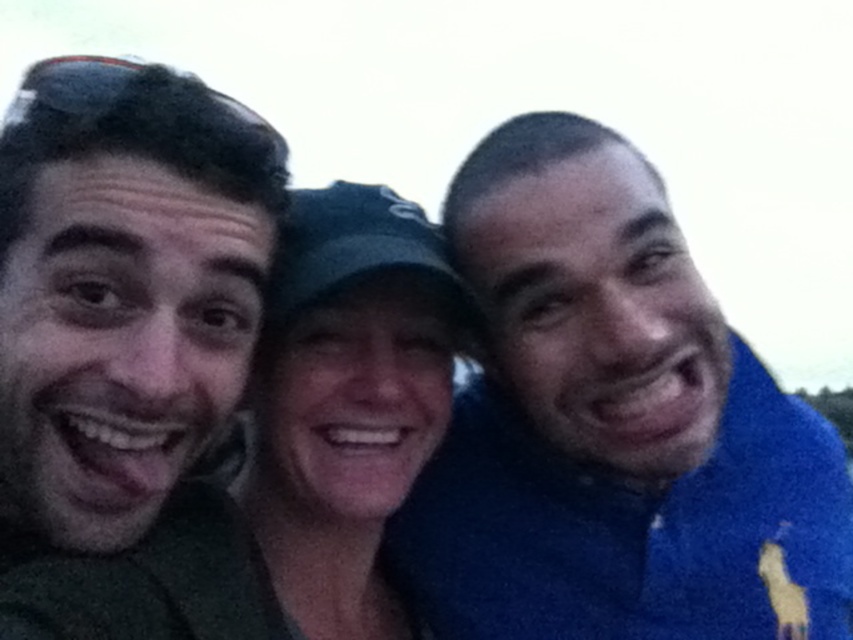
What do you see at coordinates (613, 426) in the screenshot?
I see `blue fleece jacket at right` at bounding box center [613, 426].

Does blue fleece jacket at right appear over matte green shirt at left?

Yes, blue fleece jacket at right is above matte green shirt at left.

Locate an element on the screen. blue fleece jacket at right is located at coordinates (613, 426).